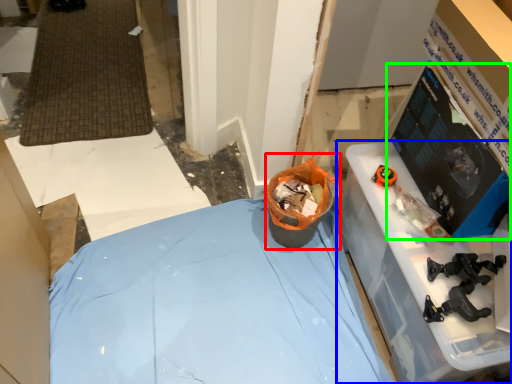
Question: Which is nearer to the garbage (highlighted by a red box)? furniture (highlighted by a blue box) or computer monitor (highlighted by a green box).

Choices:
 (A) furniture
 (B) computer monitor

Answer: (A)